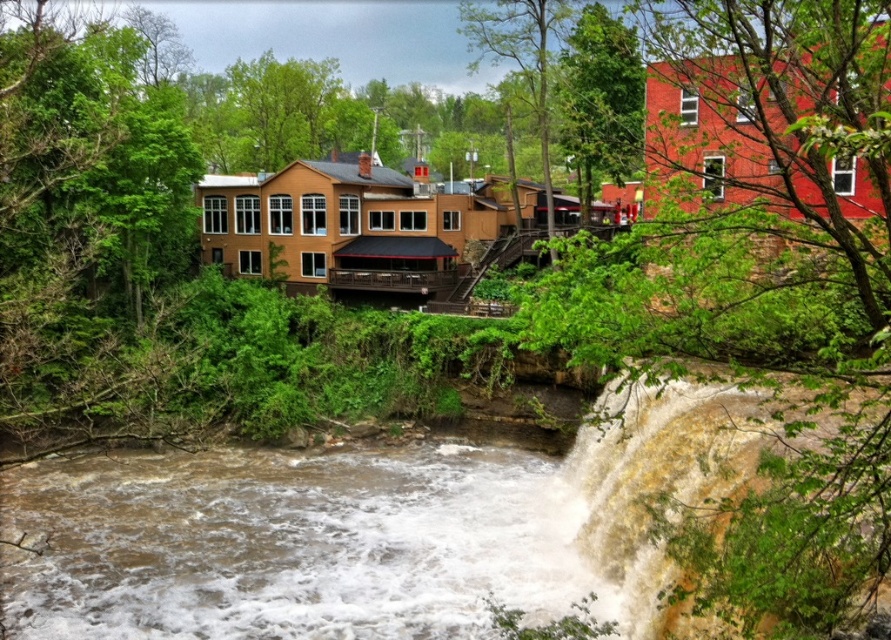
Is green leafy tree at upper right to the right of brown muddy water at lower center from the viewer's perspective?

Yes, green leafy tree at upper right is to the right of brown muddy water at lower center.

Who is more distant from viewer, (786, 236) or (184, 576)?

The point (184, 576) is behind.

Is point (751, 484) more distant than point (64, 577)?

No, it is in front of (64, 577).

This screenshot has height=640, width=891. I want to click on green leafy tree at upper right, so click(756, 301).